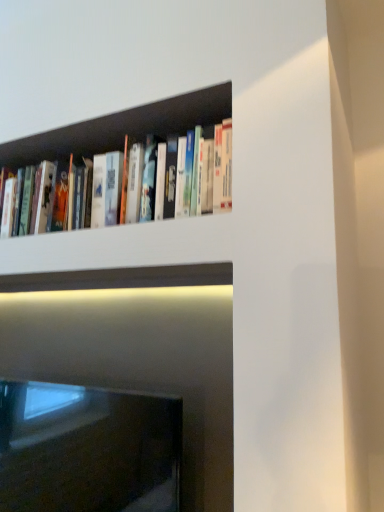
Question: From a real-world perspective, is black glass fireplace at lower left physically located above or below hardcover books at upper left?

Choices:
 (A) above
 (B) below

Answer: (B)

Question: Considering their positions, is black glass fireplace at lower left located in front of or behind hardcover books at upper left?

Choices:
 (A) front
 (B) behind

Answer: (B)

Question: In terms of size, does black glass fireplace at lower left appear bigger or smaller than hardcover books at upper left?

Choices:
 (A) big
 (B) small

Answer: (A)

Question: Visually, is hardcover books at upper left positioned to the left or to the right of black glass fireplace at lower left?

Choices:
 (A) right
 (B) left

Answer: (A)

Question: Considering the positions of point (79, 159) and point (178, 407), is point (79, 159) closer or farther from the camera than point (178, 407)?

Choices:
 (A) farther
 (B) closer

Answer: (B)

Question: Relative to black glass fireplace at lower left, is hardcover books at upper left in front or behind?

Choices:
 (A) front
 (B) behind

Answer: (A)

Question: Considering the positions of hardcover books at upper left and black glass fireplace at lower left in the image, is hardcover books at upper left bigger or smaller than black glass fireplace at lower left?

Choices:
 (A) big
 (B) small

Answer: (B)